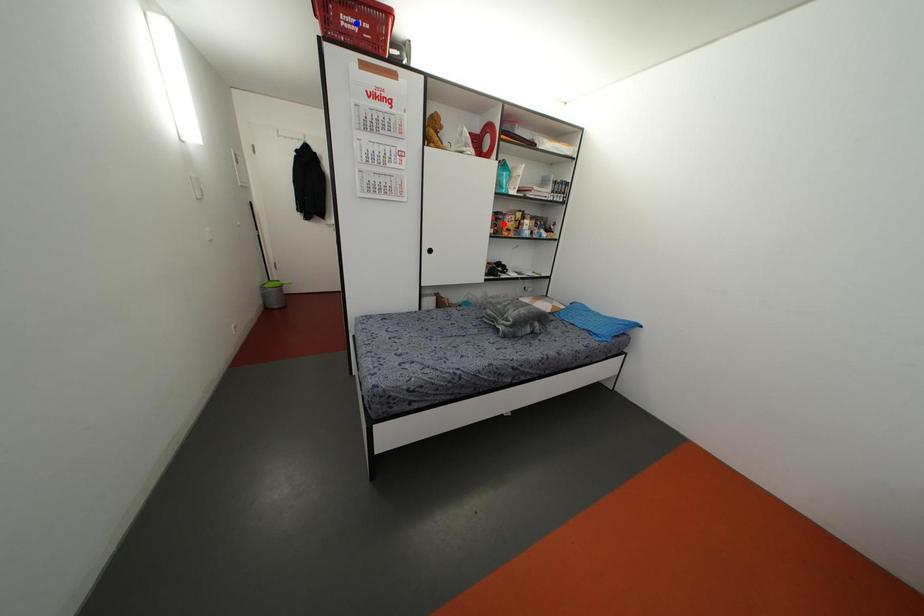
Question: In the image, two points are highlighted. Which point is nearer to the camera? Reply with the corresponding letter.

Choices:
 (A) blue point
 (B) red point

Answer: (A)